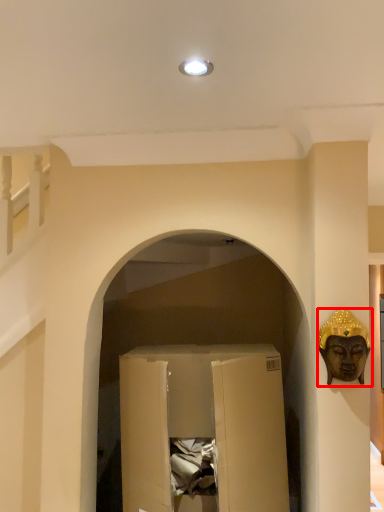
Question: From the image's perspective, where is person (annotated by the red box) located relative to wide?

Choices:
 (A) below
 (B) above

Answer: (B)